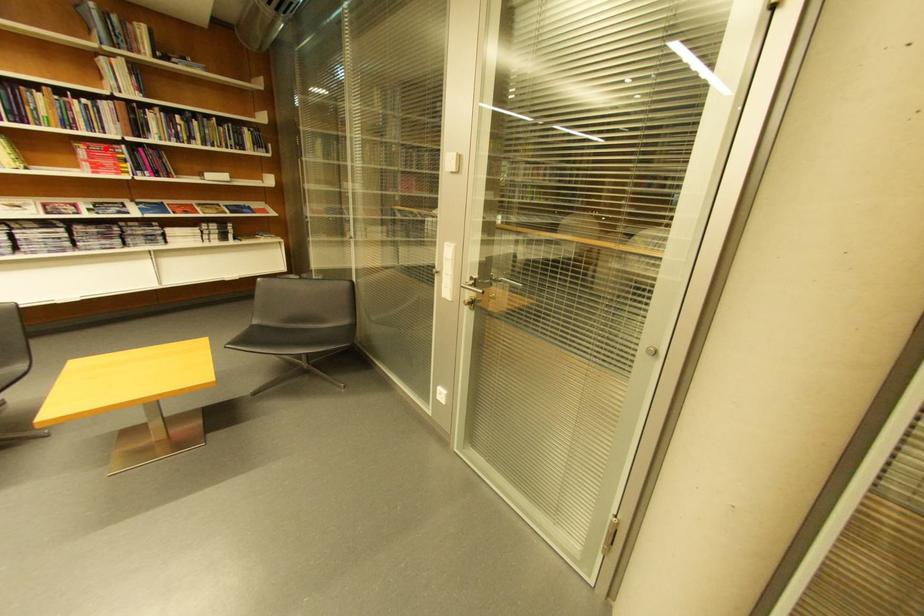
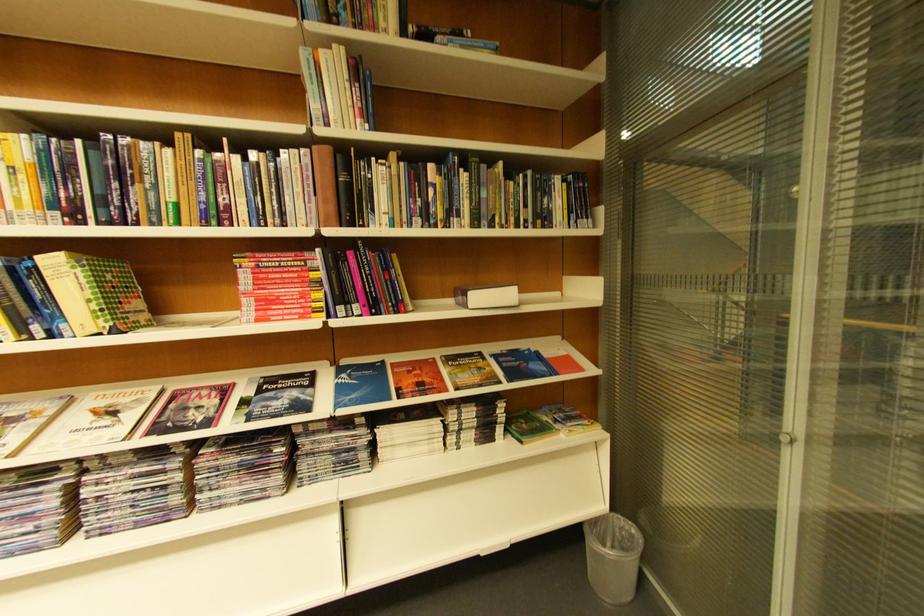
In the second image, find the point that corresponds to the highlighted location in the first image.

(281, 262)